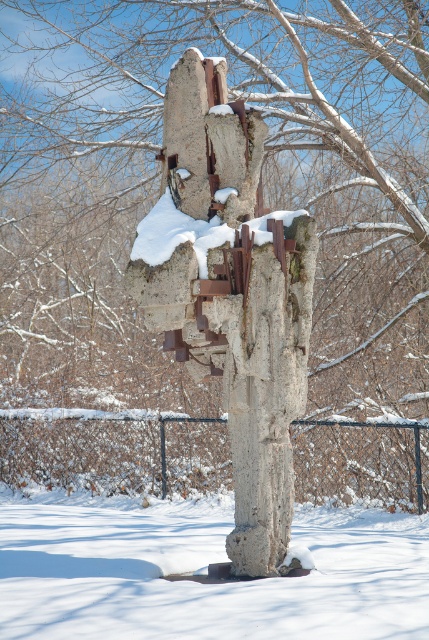
Is black chain-link fence at center positioned before white frosty snow at center?

That is False.

Where is `black chain-link fence at center`? The height and width of the screenshot is (640, 429). black chain-link fence at center is located at coordinates (112, 451).

The width and height of the screenshot is (429, 640). I want to click on black chain-link fence at center, so [112, 451].

This screenshot has width=429, height=640. I want to click on white powdery snow at lower center, so click(x=204, y=570).

Measure the distance from white powdery snow at lower center to black chain-link fence at center.

The distance of white powdery snow at lower center from black chain-link fence at center is 3.38 meters.

Measure the distance between point (368, 620) and camera.

They are 31.24 feet apart.

Find the location of a particular element. This screenshot has height=640, width=429. white powdery snow at lower center is located at coordinates (204, 570).

Between point (196, 92) and point (69, 461), which one is positioned in front?

Point (196, 92)

Can you confirm if rusty concrete sculpture at center is smaller than black chain-link fence at center?

Yes, rusty concrete sculpture at center is smaller than black chain-link fence at center.

Is point (295, 260) farther from camera compared to point (47, 477)?

No, it is in front of (47, 477).

Where is `rusty concrete sculpture at center`? This screenshot has width=429, height=640. rusty concrete sculpture at center is located at coordinates (230, 292).